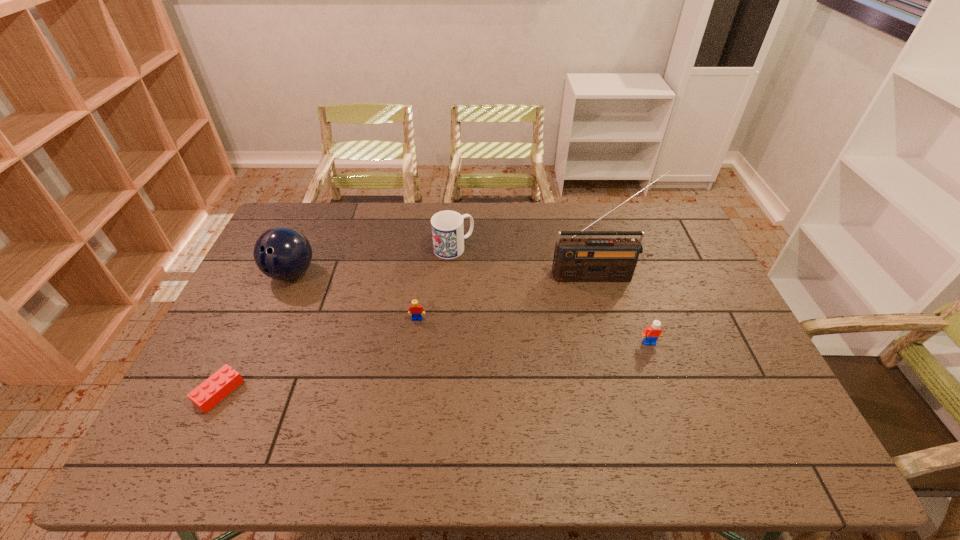
Locate an element on the screen. This screenshot has width=960, height=540. free spot between the fifth shortest object and the third nearest object is located at coordinates (354, 296).

Locate an element on the screen. The width and height of the screenshot is (960, 540). empty space between the third tallest object and the fifth farthest object is located at coordinates (551, 295).

You are a GUI agent. You are given a task and a screenshot of the screen. Output one action in this format:
    pyautogui.click(x=<x>, y=<y>)
    Task: Click on the empty space that is in between the second nearest Lego and the mug
    
    Given the screenshot: What is the action you would take?
    pyautogui.click(x=551, y=295)

You are a GUI agent. You are given a task and a screenshot of the screen. Output one action in this format:
    pyautogui.click(x=<x>, y=<y>)
    Task: Click on the free area in between the second tallest object and the second farthest Lego
    The width and height of the screenshot is (960, 540).
    Given the screenshot: What is the action you would take?
    pyautogui.click(x=470, y=308)

The image size is (960, 540). I want to click on vacant area that lies between the shortest Lego and the tallest object, so click(x=408, y=334).

Choose which object is the nearest neighbor to the bowling ball. Please provide its 2D coordinates. Your answer should be formatted as a tuple, i.e. [(x, y)], where the tuple contains the x and y coordinates of a point satisfying the conditions above.

[(209, 393)]

Where is `object identified as the second closest to the farthest Lego`? The width and height of the screenshot is (960, 540). object identified as the second closest to the farthest Lego is located at coordinates (282, 253).

Point out which Lego is positioned as the nearest to the third nearest object. Please provide its 2D coordinates. Your answer should be formatted as a tuple, i.e. [(x, y)], where the tuple contains the x and y coordinates of a point satisfying the conditions above.

[(209, 393)]

Locate an element on the screen. The image size is (960, 540). Lego that stands as the closest to the farthest Lego is located at coordinates (209, 393).